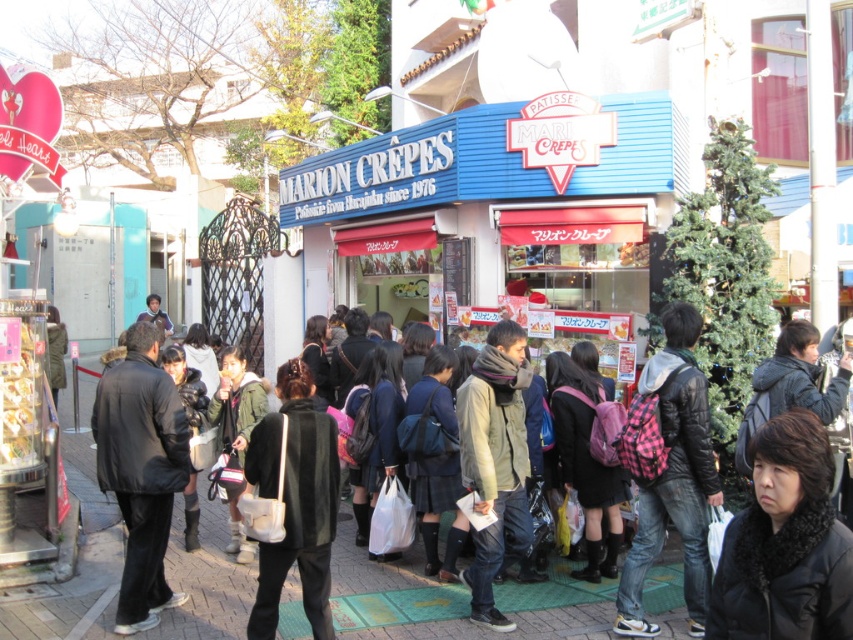
Question: Is dark gray jacket at center to the left of pink plaid backpack at center from the viewer's perspective?

Choices:
 (A) no
 (B) yes

Answer: (B)

Question: Considering the real-world distances, which object is closest to the black matte jacket at center?

Choices:
 (A) dark gray jacket at center
 (B) khaki fabric jacket at center
 (C) black fur-trimmed coat at lower right
 (D) pink plaid backpack at center

Answer: (A)

Question: Is black leather jacket at left positioned before khaki fabric jacket at center?

Choices:
 (A) yes
 (B) no

Answer: (A)

Question: Among these objects, which one is nearest to the camera?

Choices:
 (A) khaki fabric jacket at center
 (B) dark gray jacket at center

Answer: (B)

Question: Does black leather jacket at left have a smaller size compared to dark gray jacket at center?

Choices:
 (A) no
 (B) yes

Answer: (A)

Question: Estimate the real-world distances between objects in this image. Which object is farther from the black fur-trimmed coat at lower right?

Choices:
 (A) pink plaid backpack at center
 (B) black matte jacket at center

Answer: (B)